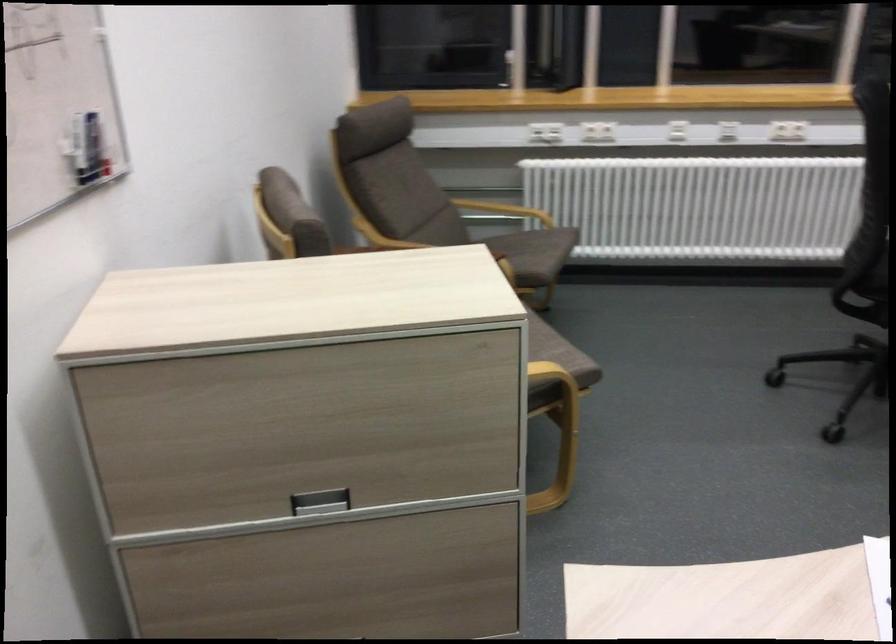
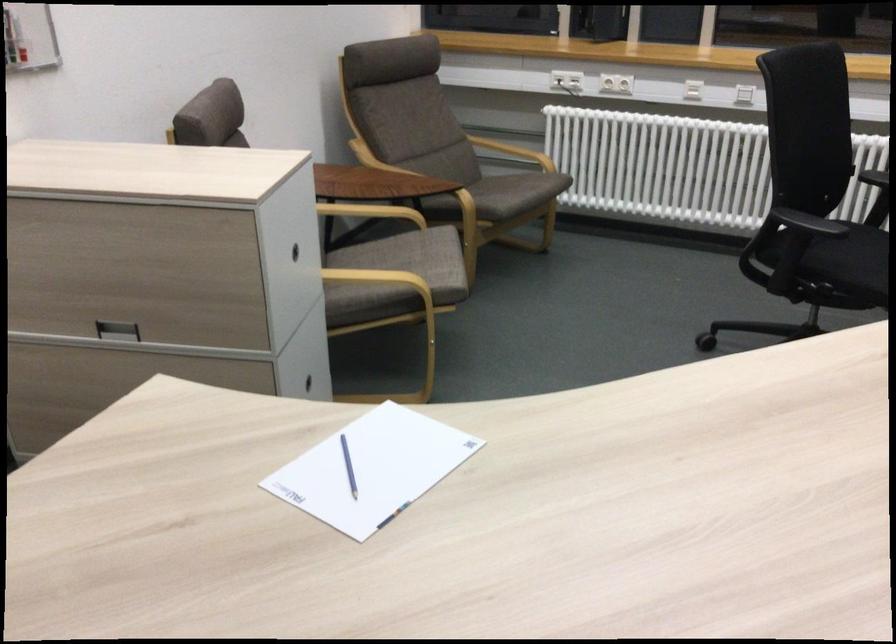
Locate, in the second image, the point that corresponds to (x=554, y=129) in the first image.

(566, 80)